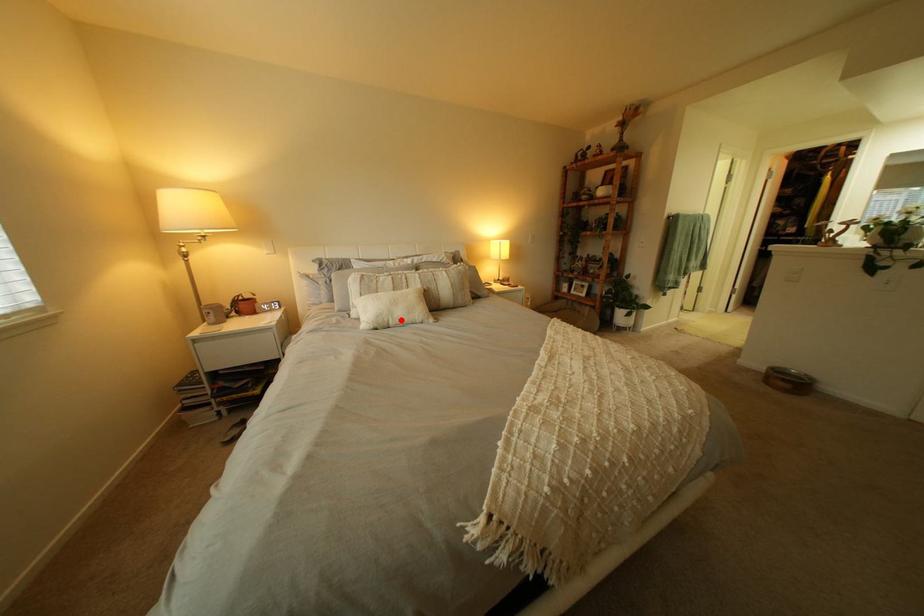
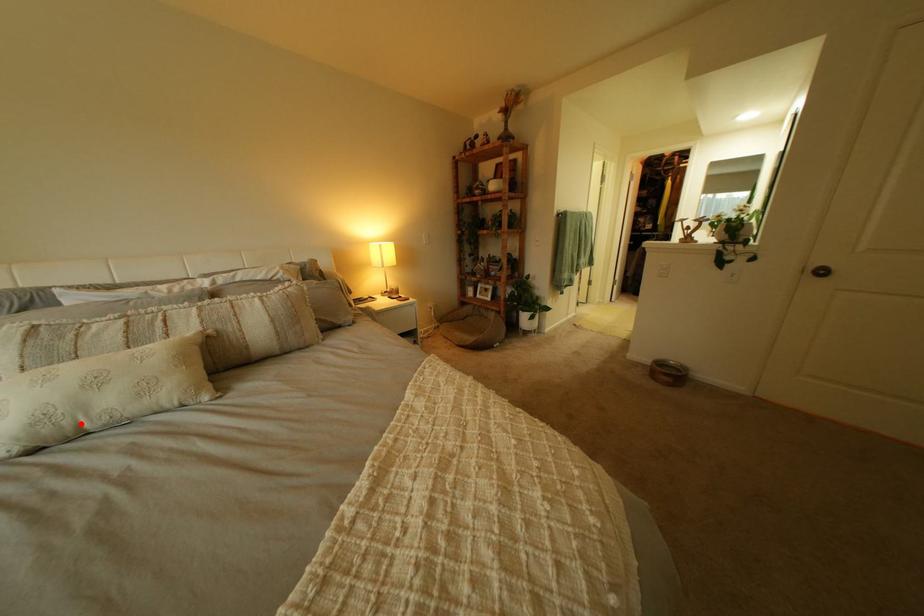
I am providing you with two images of the same scene from different viewpoints. A red point is marked on the first image and another point is marked on the second image. Do the highlighted points in image1 and image2 indicate the same real-world spot?

Yes